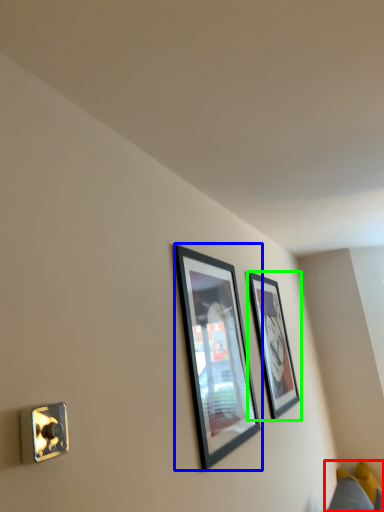
Question: Which object is positioned closest to couch (highlighted by a red box)? Select from picture frame (highlighted by a blue box) and picture frame (highlighted by a green box).

Choices:
 (A) picture frame
 (B) picture frame

Answer: (B)